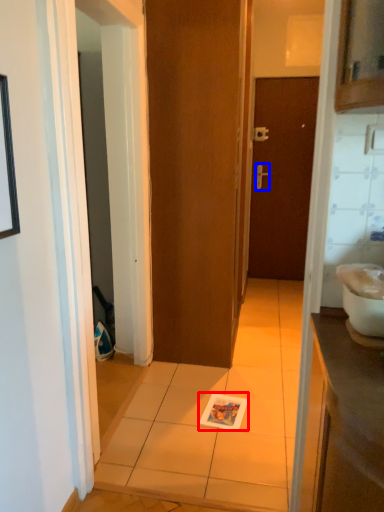
Question: Which object appears farthest to the camera in this image, magazine (highlighted by a red box) or door handle (highlighted by a blue box)?

Choices:
 (A) magazine
 (B) door handle

Answer: (B)